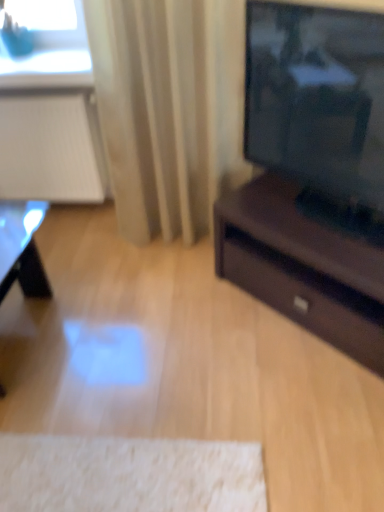
This screenshot has height=512, width=384. What are the coordinates of `vacant space to the right of shiny black table at lower left` in the screenshot? It's located at (114, 350).